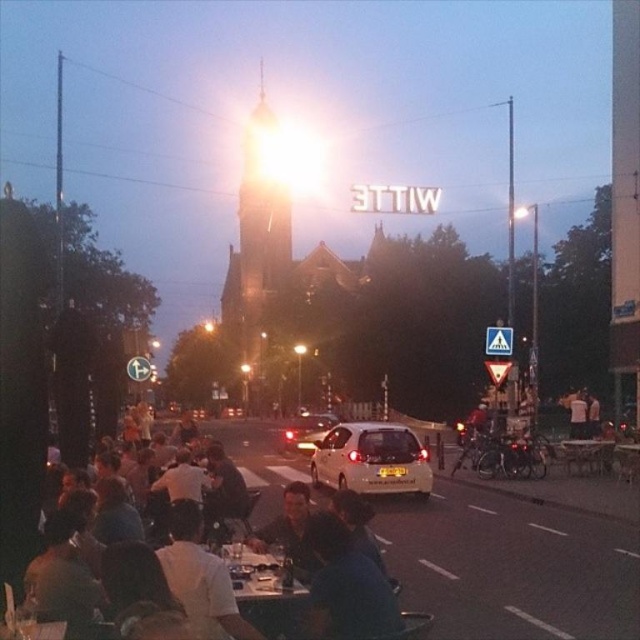
You are a photographer setting up a tripod to capture the illuminated sign. You need to place the tripod between the dark blue fabric at lower left and the white matte car at center. Which object should you position the tripod closer to if you want it to be near the wider object?

The dark blue fabric at lower left might be wider than the white matte car at center, so positioning the tripod closer to the dark blue fabric at lower left would place it near the wider object.

You are a photographer setting up a shot of the dark blue fabric at lower left and the white glossy table at center. Which object is positioned higher in the frame?

The dark blue fabric at lower left is much taller than the white glossy table at center, so it is positioned higher in the frame.